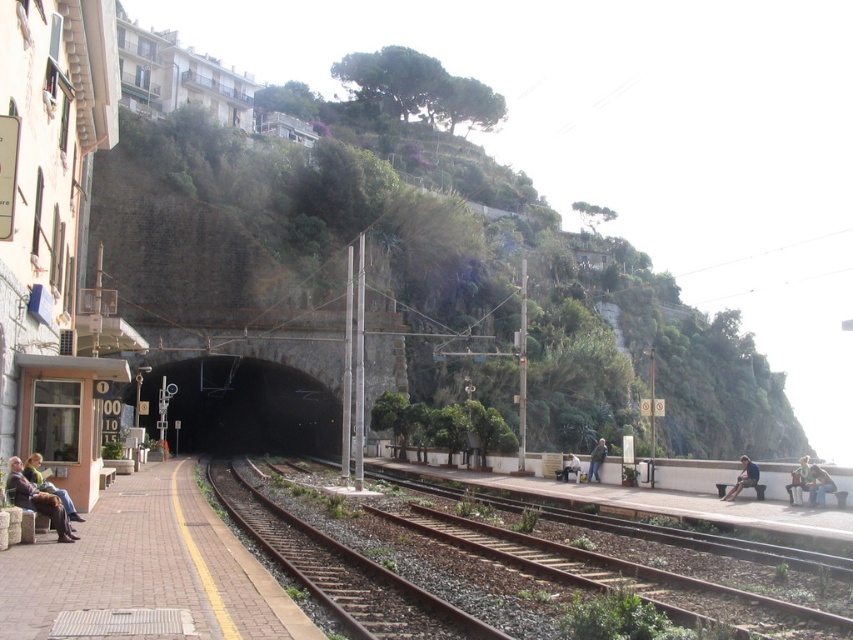
Question: Which point appears closest to the camera in this image?

Choices:
 (A) (804, 461)
 (B) (148, 387)
 (C) (39, 499)
 (D) (486, 634)

Answer: (D)

Question: Which of these objects is positioned farthest from the leather jacket at lower left?

Choices:
 (A) blue denim jeans at right
 (B) light blue denim jacket at center

Answer: (B)

Question: Does rusty metal tracks at center come in front of black concrete tunnel at center?

Choices:
 (A) yes
 (B) no

Answer: (A)

Question: Among these points, which one is farthest from the camera?

Choices:
 (A) (177, 412)
 (B) (299, 548)
 (C) (815, 612)
 (D) (578, 468)

Answer: (A)

Question: Can you confirm if leather jacket at lower left is positioned below light blue denim jacket at center?

Choices:
 (A) no
 (B) yes

Answer: (A)

Question: Where is black concrete tunnel at center located in relation to leather jacket at lower left in the image?

Choices:
 (A) below
 (B) above

Answer: (A)